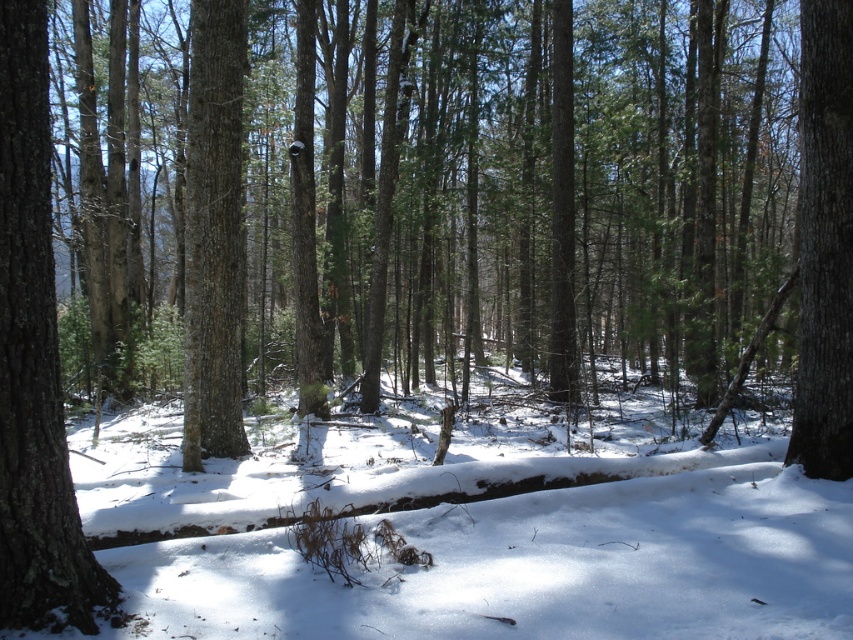
Can you confirm if white powdery snow at center is shorter than smooth brown tree trunk at center?

In fact, white powdery snow at center may be taller than smooth brown tree trunk at center.

Is white powdery snow at center positioned behind smooth brown tree trunk at center?

No.

Between point (712, 461) and point (183, 467), which one is positioned in front?

Point (712, 461) is in front.

At what (x,y) coordinates should I click in order to perform the action: click on white powdery snow at center. Please return your answer as a coordinate pair (x, y). This screenshot has height=640, width=853. Looking at the image, I should click on (473, 538).

Consider the image. Is white powdery snow at center positioned behind smooth bark tree at left?

Yes, white powdery snow at center is further from the viewer.

The width and height of the screenshot is (853, 640). In order to click on white powdery snow at center in this screenshot , I will do `click(473, 538)`.

Does point (196, 572) come in front of point (10, 35)?

That is False.

At what (x,y) coordinates should I click in order to perform the action: click on white powdery snow at center. Please return your answer as a coordinate pair (x, y). The width and height of the screenshot is (853, 640). Looking at the image, I should click on (473, 538).

Can you confirm if smooth bark tree at left is thinner than smooth brown tree trunk at center?

No.

Does smooth bark tree at left have a smaller size compared to smooth brown tree trunk at center?

No.

The width and height of the screenshot is (853, 640). What are the coordinates of `smooth bark tree at left` in the screenshot? It's located at (33, 362).